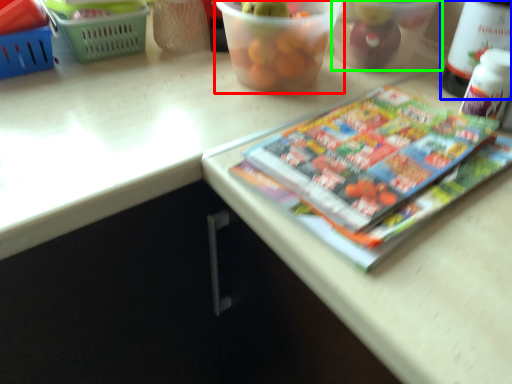
Question: Based on their relative distances, which object is nearer to glass bowl (highlighted by a red box)? Choose from wine bottle (highlighted by a blue box) and glass bowl (highlighted by a green box).

Choices:
 (A) wine bottle
 (B) glass bowl

Answer: (B)